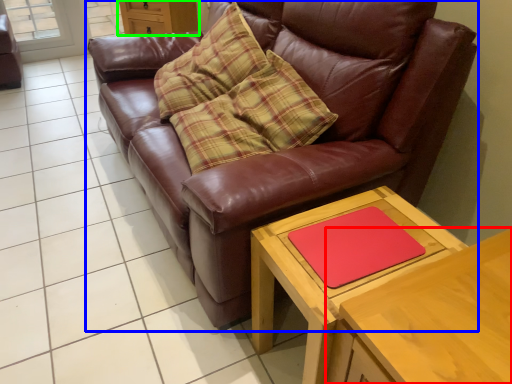
Question: Considering the real-world distances, which object is farthest from table (highlighted by a red box)? studio couch (highlighted by a blue box) or dresser (highlighted by a green box)?

Choices:
 (A) studio couch
 (B) dresser

Answer: (B)